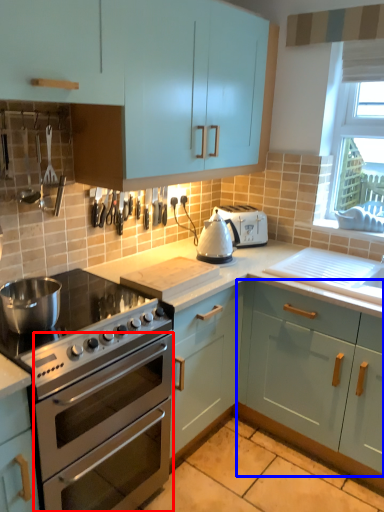
Question: Which object is closer to the camera taking this photo, oven (highlighted by a red box) or cabinetry (highlighted by a blue box)?

Choices:
 (A) oven
 (B) cabinetry

Answer: (A)